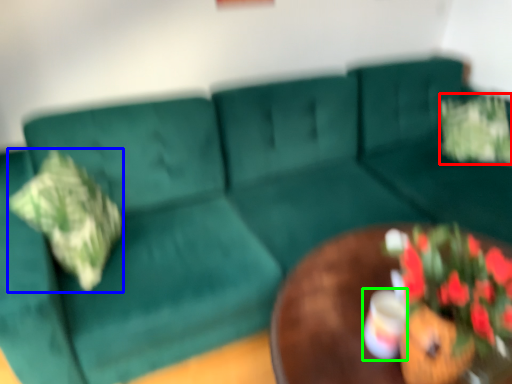
Question: Which is nearer to the flower (highlighted by a red box)? pillow (highlighted by a blue box) or coffee cup (highlighted by a green box).

Choices:
 (A) pillow
 (B) coffee cup

Answer: (B)